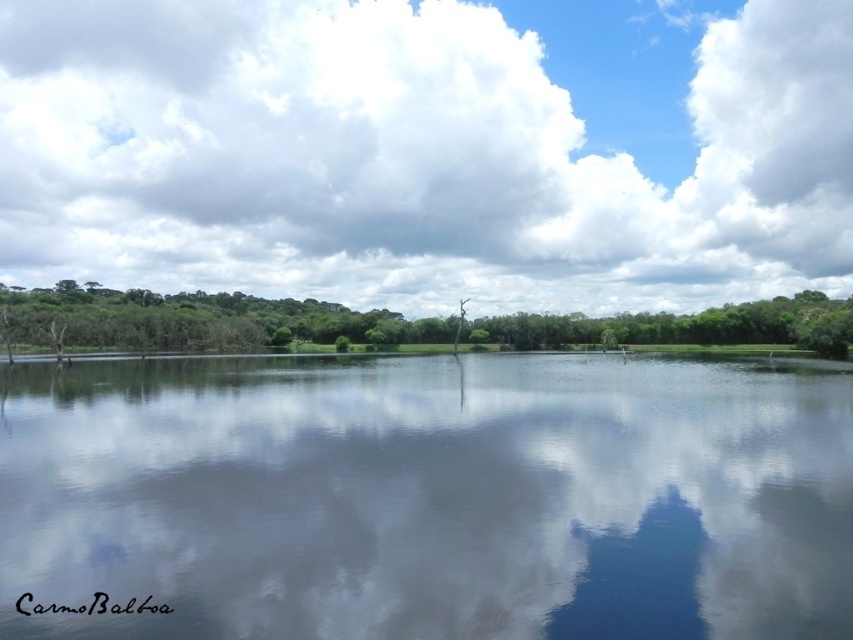
You are a bird flying over the serene landscape. You see the smooth reflective water at center and the green leafy tree at center. Which object is located below the other?

The smooth reflective water at center is positioned under the green leafy tree at center, so the water is below the tree.

You are an observer looking at the landscape. Which object is positioned higher in the image, the cloudy sky at upper center or the green leafy tree at center?

The cloudy sky at upper center is positioned higher than the green leafy tree at center in the image.